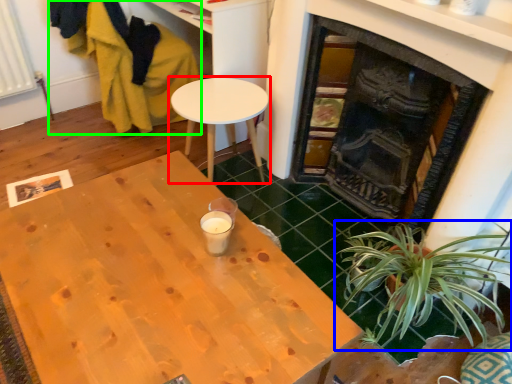
Question: Which object is the farthest from table (highlighted by a red box)? Choose among these: houseplant (highlighted by a blue box) or swivel chair (highlighted by a green box).

Choices:
 (A) houseplant
 (B) swivel chair

Answer: (A)